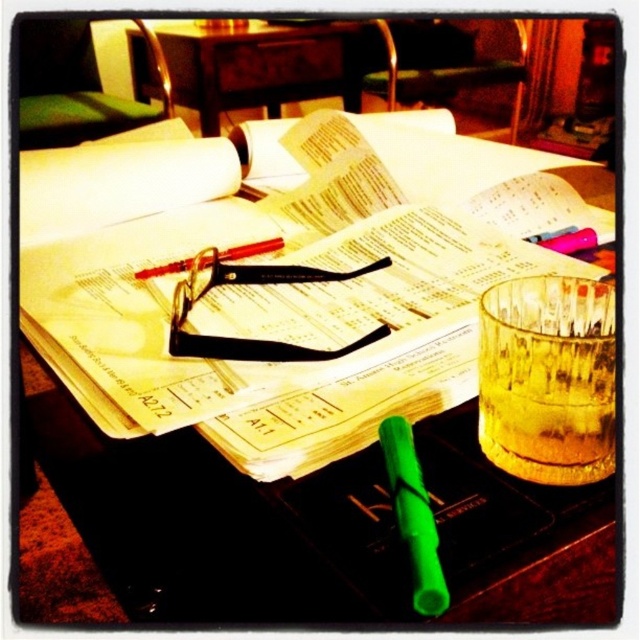
Question: Which point is closer to the camera?

Choices:
 (A) click(x=502, y=451)
 (B) click(x=284, y=65)

Answer: (A)

Question: Can you confirm if translucent glass cup at center is positioned below green matte pencil at center?

Choices:
 (A) no
 (B) yes

Answer: (A)

Question: Where is translucent glass cup at center located in relation to black plastic glasses at center in the image?

Choices:
 (A) below
 (B) above

Answer: (A)

Question: Which object appears closest to the camera in this image?

Choices:
 (A) translucent glass cup at center
 (B) black plastic glasses at center
 (C) wooden table at center
 (D) green matte pencil at center

Answer: (D)

Question: Which point is farther to the camera?

Choices:
 (A) (198, 348)
 (B) (177, 74)

Answer: (B)

Question: Can you confirm if wooden table at center is bigger than green matte pencil at center?

Choices:
 (A) yes
 (B) no

Answer: (A)